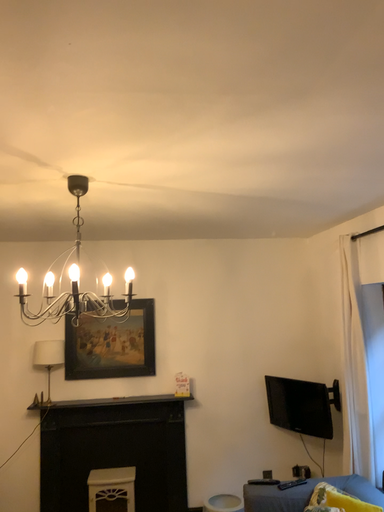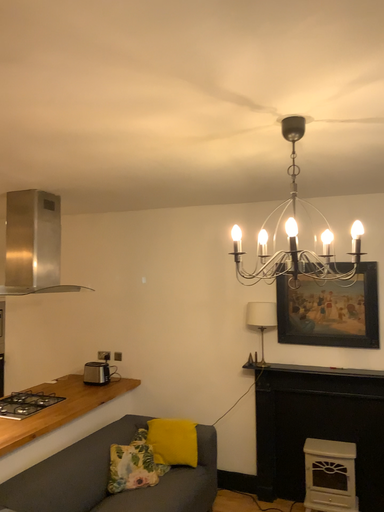
Question: Which way did the camera rotate in the video?

Choices:
 (A) rotated left
 (B) rotated right

Answer: (A)